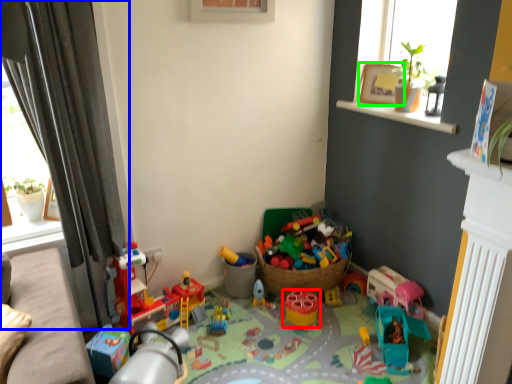
Question: Estimate the real-world distances between objects in this image. Which object is farther from toy (highlighted by a red box), curtain (highlighted by a blue box) or picture frame (highlighted by a green box)?

Choices:
 (A) curtain
 (B) picture frame

Answer: (A)